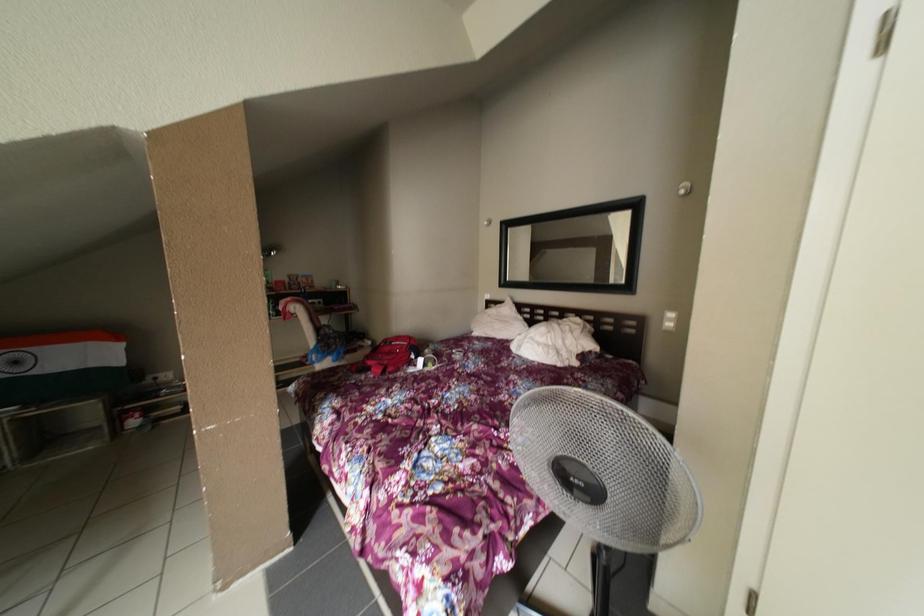
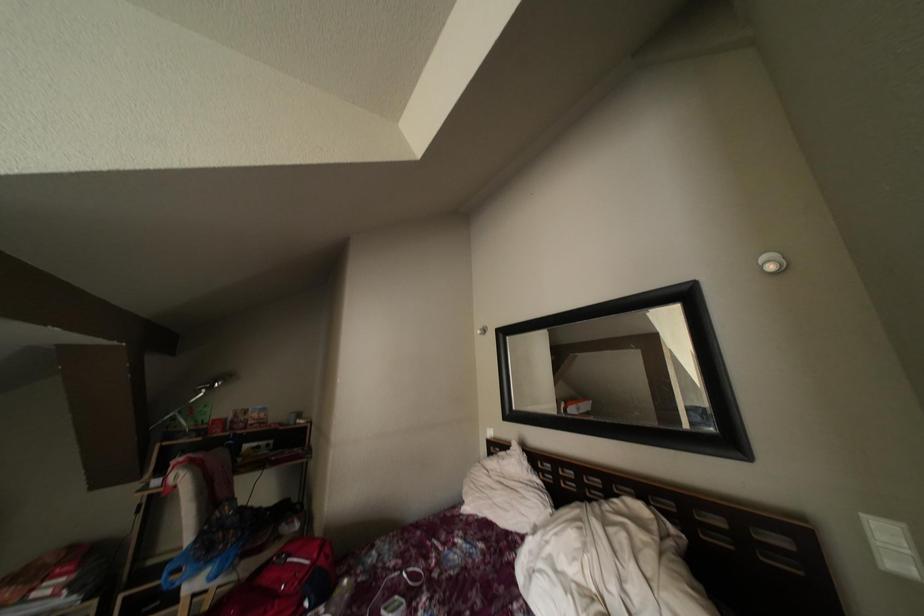
Question: The first image is from the beginning of the video and the second image is from the end. How did the camera likely rotate when shooting the video?

Choices:
 (A) Left
 (B) Right
 (C) Up
 (D) Down

Answer: (C)